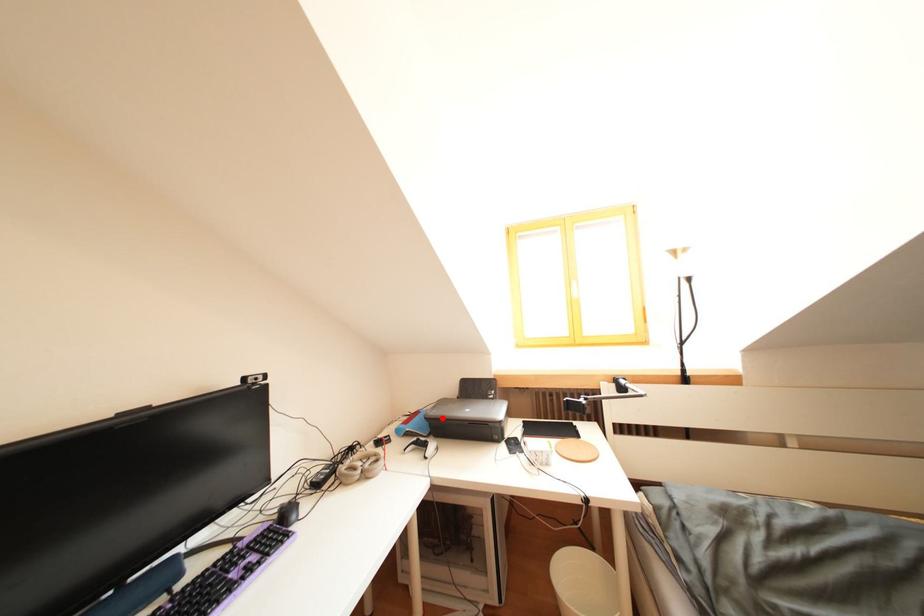
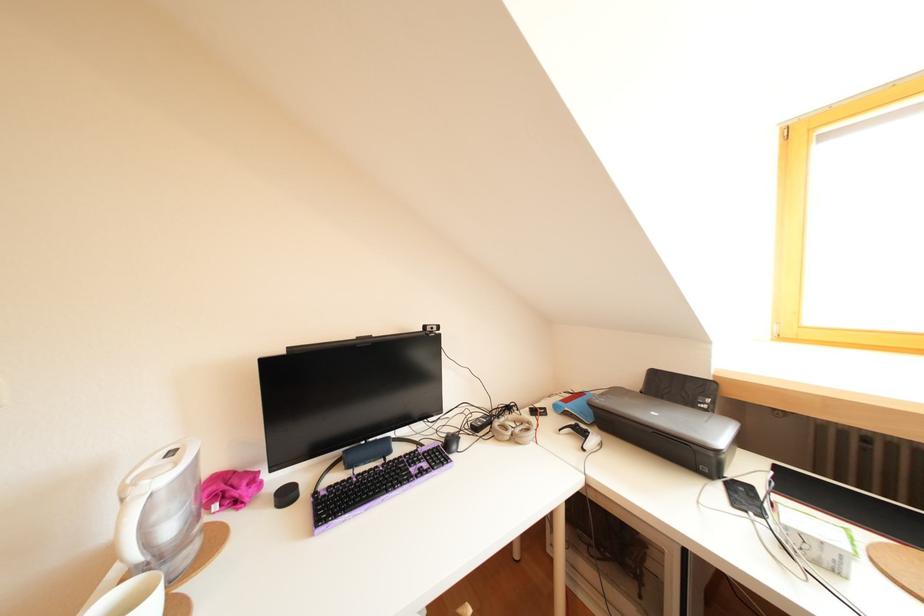
Question: I am providing you with two images of the same scene from different viewpoints. A red point is shown in image1. For the corresponding object point in image2, is it positioned nearer or farther from the camera?

Choices:
 (A) Nearer
 (B) Farther

Answer: (A)